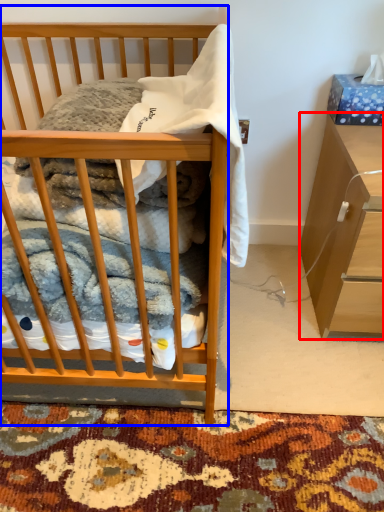
Question: Among these objects, which one is farthest to the camera, cabinetry (highlighted by a red box) or desk (highlighted by a blue box)?

Choices:
 (A) cabinetry
 (B) desk

Answer: (A)